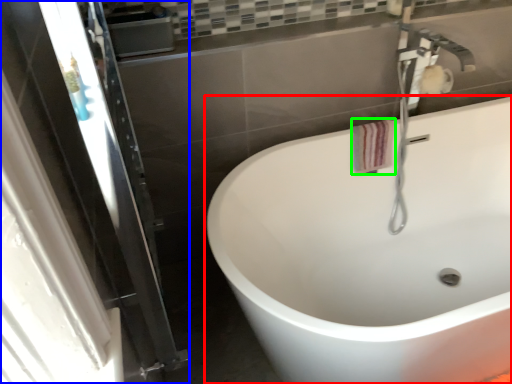
Question: Based on their relative distances, which object is farther from bathtub (highlighted by a red box)? Choose from screen door (highlighted by a blue box) and hand towel (highlighted by a green box).

Choices:
 (A) screen door
 (B) hand towel

Answer: (A)